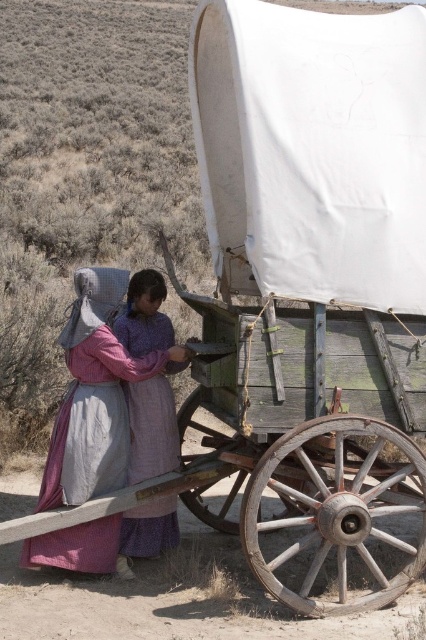
You are standing at the point labeled as point (302, 449) in the image. What object are you directly facing?

The point labeled as point (302, 449) corresponds to the wooden wagon at center, so you are directly facing the wooden wagon at center.

You are standing in the historical landscape and want to approach both the rustic woolen dress at lower left and the matte purple dress at center. Which dress should you approach first to reach the one closer to you?

You should approach the rustic woolen dress at lower left first because it is closer to you than the matte purple dress at center.

You are a traveler who needs to reach the white canvas wagon at upper center to load supplies. There is a matte purple dress at center in your path. Can you walk straight to the wagon without moving the dress?

The white canvas wagon at upper center and the matte purple dress at center are 1.21 meters apart. Since the distance is sufficient, you can walk straight to the wagon without moving the dress.